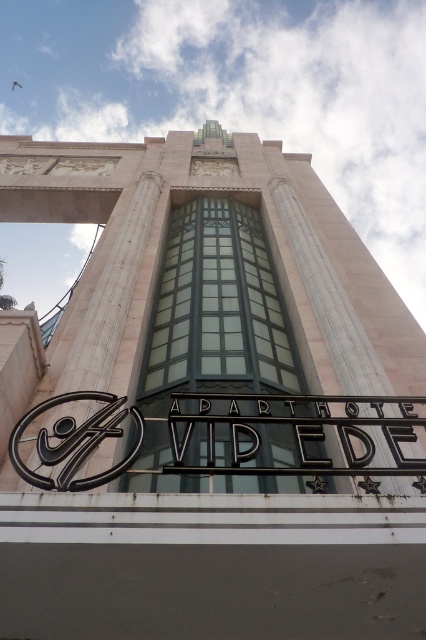
Question: Which point is closer to the camera?

Choices:
 (A) black glossy logo at center
 (B) black metal sign at center

Answer: (B)

Question: Can you confirm if black metal sign at center is smaller than black glossy logo at center?

Choices:
 (A) yes
 (B) no

Answer: (B)

Question: Among these points, which one is nearest to the camera?

Choices:
 (A) (252, 413)
 (B) (43, 483)

Answer: (B)

Question: Is black metal sign at center thinner than black glossy logo at center?

Choices:
 (A) no
 (B) yes

Answer: (A)

Question: Is black metal sign at center to the right of black glossy logo at center from the viewer's perspective?

Choices:
 (A) yes
 (B) no

Answer: (A)